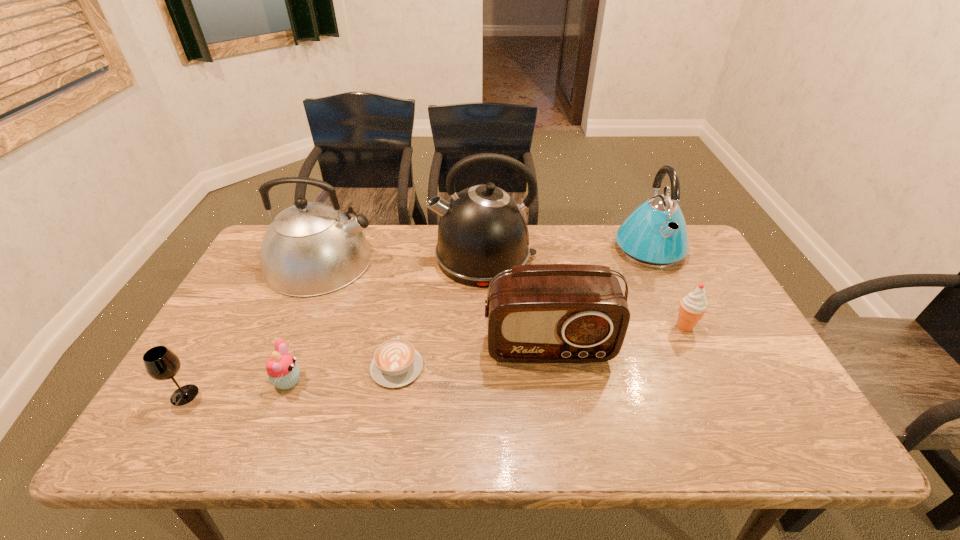
Image resolution: width=960 pixels, height=540 pixels. Find the location of `the second kettle from left to right`. the second kettle from left to right is located at coordinates (482, 231).

The image size is (960, 540). Identify the location of the tallest object. (482, 231).

Locate an element on the screen. This screenshot has height=540, width=960. the leftmost kettle is located at coordinates (311, 248).

Locate an element on the screen. This screenshot has height=540, width=960. the rightmost kettle is located at coordinates coord(655,235).

Find the location of `radio receiver`. radio receiver is located at coordinates (547, 313).

Where is `icecream`? icecream is located at coordinates (693, 306).

Locate an element on the screen. wineglass is located at coordinates (160, 363).

This screenshot has height=540, width=960. In order to click on the second shortest object in this screenshot , I will do click(x=283, y=372).

The image size is (960, 540). In order to click on cappuccino in this screenshot , I will do `click(396, 363)`.

Where is `vacant area situated on the spout of the tallest object`? vacant area situated on the spout of the tallest object is located at coordinates (399, 258).